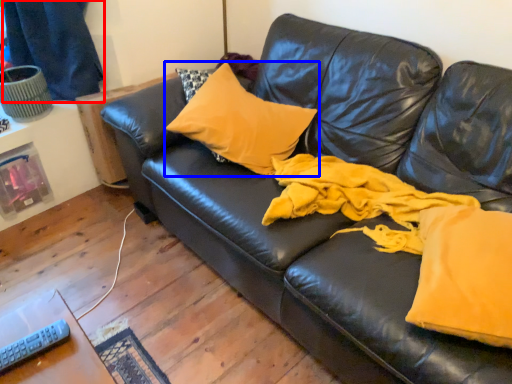
Question: Among these objects, which one is nearest to the camera, curtain (highlighted by a red box) or pillow (highlighted by a blue box)?

Choices:
 (A) curtain
 (B) pillow

Answer: (B)